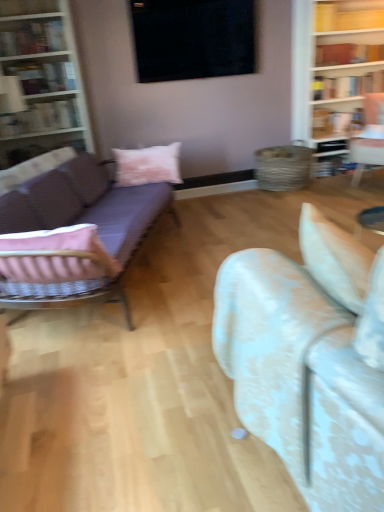
Question: From a real-world perspective, does purple fabric couch at left, which ranks as the second studio couch in front-to-back order, stand above white floral fabric couch at center, the first studio couch positioned from the right?

Choices:
 (A) no
 (B) yes

Answer: (A)

Question: Does purple fabric couch at left, which ranks as the second studio couch in front-to-back order, come in front of white floral fabric couch at center, the second studio couch from the left?

Choices:
 (A) no
 (B) yes

Answer: (A)

Question: Considering the relative sizes of purple fabric couch at left, which is counted as the first studio couch, starting from the back, and white floral fabric couch at center, the first studio couch positioned from the right, in the image provided, is purple fabric couch at left, which is counted as the first studio couch, starting from the back, wider than white floral fabric couch at center, the first studio couch positioned from the right,?

Choices:
 (A) yes
 (B) no

Answer: (B)

Question: Can you confirm if purple fabric couch at left, which is counted as the first studio couch, starting from the back, is bigger than white floral fabric couch at center, the first studio couch when ordered from front to back?

Choices:
 (A) no
 (B) yes

Answer: (B)

Question: Does purple fabric couch at left, the first studio couch positioned from the left, have a lesser width compared to white floral fabric couch at center, the 2th studio couch positioned from the back?

Choices:
 (A) yes
 (B) no

Answer: (A)

Question: Based on their sizes in the image, would you say yellow wood shelf at upper right is bigger or smaller than matte white bookshelf at left, the 3th book in the back-to-front sequence?

Choices:
 (A) small
 (B) big

Answer: (A)

Question: Visually, is yellow wood shelf at upper right positioned to the left or to the right of matte white bookshelf at left, placed as the first book when sorted from left to right?

Choices:
 (A) left
 (B) right

Answer: (B)

Question: Choose the correct answer: Is yellow wood shelf at upper right inside matte white bookshelf at left, placed as the fourth book when sorted from right to left, or outside it?

Choices:
 (A) inside
 (B) outside

Answer: (B)

Question: Is yellow wood shelf at upper right wider or thinner than matte white bookshelf at left, placed as the first book when sorted from left to right?

Choices:
 (A) thin
 (B) wide

Answer: (A)

Question: Is matte black bookshelf at upper left, positioned as the 1th book in front-to-back order, wider or thinner than white floral fabric couch at center, the first studio couch when ordered from front to back?

Choices:
 (A) thin
 (B) wide

Answer: (A)

Question: Which is correct: matte black bookshelf at upper left, positioned as the 1th book in front-to-back order, is inside white floral fabric couch at center, the first studio couch positioned from the right, or outside of it?

Choices:
 (A) inside
 (B) outside

Answer: (B)

Question: Is matte black bookshelf at upper left, which appears as the 3th book when viewed from the right, in front of or behind white floral fabric couch at center, the first studio couch when ordered from front to back, in the image?

Choices:
 (A) front
 (B) behind

Answer: (B)

Question: From a real-world perspective, relative to white floral fabric couch at center, the first studio couch when ordered from front to back, is matte black bookshelf at upper left, the second book from the left, vertically above or below?

Choices:
 (A) above
 (B) below

Answer: (A)

Question: From a real-world perspective, relative to hardcover book at upper right, positioned as the 4th book in front-to-back order, is purple fabric couch at left, acting as the second studio couch starting from the right, vertically above or below?

Choices:
 (A) below
 (B) above

Answer: (A)

Question: Relative to hardcover book at upper right, positioned as the 4th book in front-to-back order, is purple fabric couch at left, which is counted as the first studio couch, starting from the back, in front or behind?

Choices:
 (A) behind
 (B) front

Answer: (B)